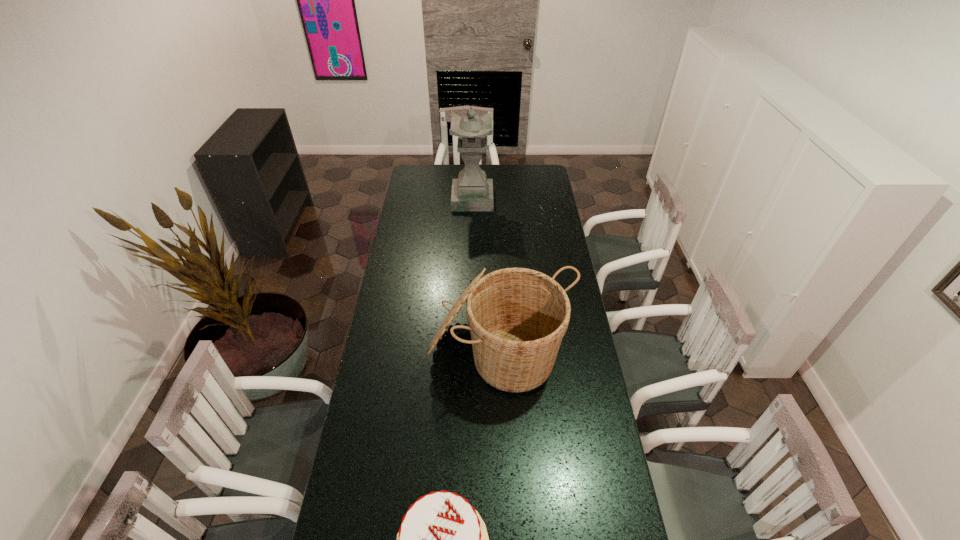
The height and width of the screenshot is (540, 960). Identify the location of vacant space at the far left corner of the desktop. (414, 176).

Where is `vacant point at the far right corner`? The width and height of the screenshot is (960, 540). vacant point at the far right corner is located at coordinates (547, 170).

Select which object appears as the second closest to the birthday cake. Please provide its 2D coordinates. Your answer should be formatted as a tuple, i.e. [(x, y)], where the tuple contains the x and y coordinates of a point satisfying the conditions above.

[(472, 191)]

You are a GUI agent. You are given a task and a screenshot of the screen. Output one action in this format:
    pyautogui.click(x=<x>, y=<y>)
    Task: Click on the closest object to the second tallest object
    This screenshot has width=960, height=540.
    Given the screenshot: What is the action you would take?
    pyautogui.click(x=442, y=539)

This screenshot has width=960, height=540. What are the coordinates of `vacant area in the image that satisfies the following two spatial constraints: 1. at the front opening of the farthest object; 2. on the left side of the basket` in the screenshot? It's located at (469, 350).